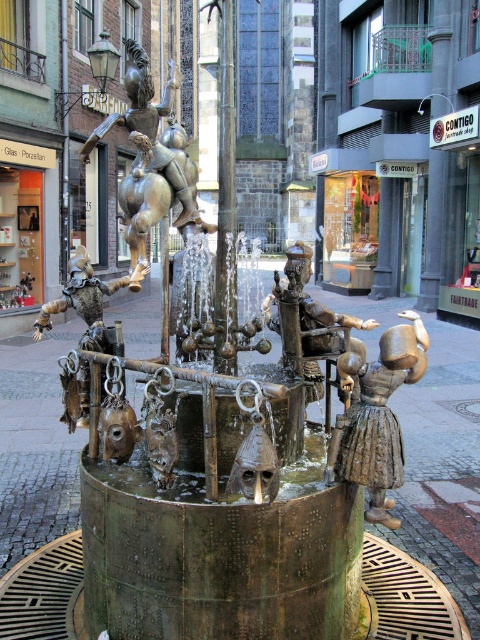
You are an urban planner assessing the fountain sculpture for maintenance. You need to determine if the bronze statue at upper center can be safely accessed for cleaning without obstructing the view of the bronze figure at center. Based on their relative widths, is this feasible?

The bronze statue at upper center might be wider than bronze figure at center, so there is a possibility that accessing it could obstruct the view of the bronze figure at center. Further measurements or visual assessment would be needed to confirm.

You are a tourist standing in front of the fountain sculpture. You notice two bronze figures, the bronze statue at upper center and the bronze figure at center. Which one appears closer to you?

The bronze statue at upper center appears closer to you because it is further to the viewer than the bronze figure at center.

You are an urban planner assessing the fountain sculpture. You need to determine if the bronze statue at upper center can be safely moved to the position currently occupied by the bronze figure at center. Based on their sizes, is this feasible?

The bronze statue at upper center is larger in size than the bronze figure at center. Moving the larger statue to the smaller figure position may not be feasible due to size mismatch, unless the new location can accommodate its increased dimensions.